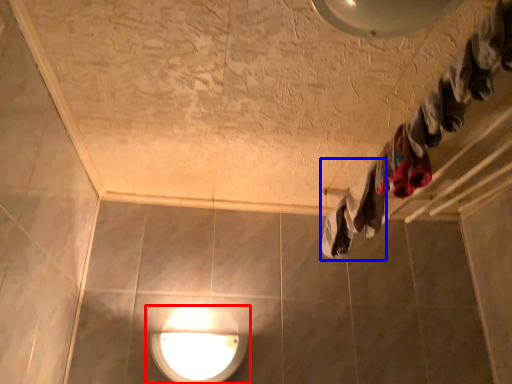
Question: Which point is closer to the camera, lamp (highlighted by a red box) or clothing (highlighted by a blue box)?

Choices:
 (A) lamp
 (B) clothing

Answer: (B)